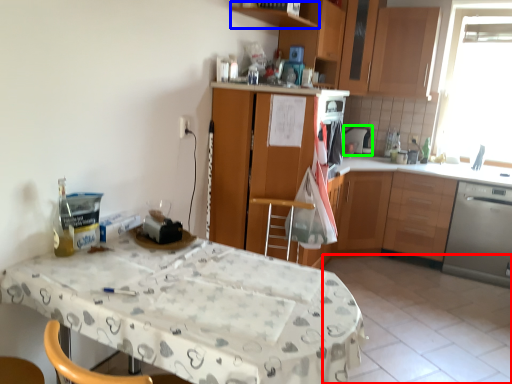
Question: Considering the real-world distances, which object is farthest from tile (highlighted by a red box)? shelf (highlighted by a blue box) or appliance (highlighted by a green box)?

Choices:
 (A) shelf
 (B) appliance

Answer: (A)